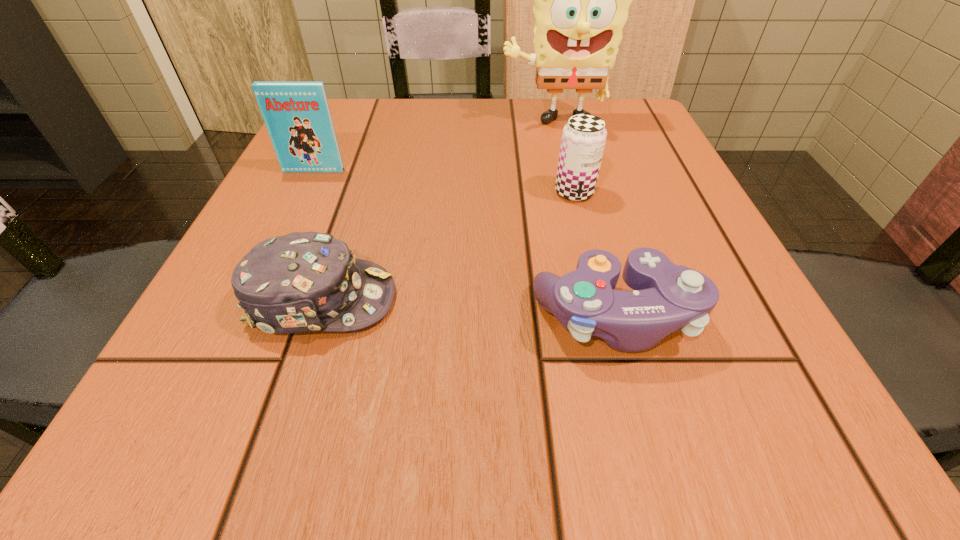
At what (x,y) coordinates should I click in order to perform the action: click on the tallest object. Please return your answer as a coordinate pair (x, y). The width and height of the screenshot is (960, 540). Looking at the image, I should click on (582, 0).

At what (x,y) coordinates should I click in order to perform the action: click on the farthest object. Please return your answer as a coordinate pair (x, y). Image resolution: width=960 pixels, height=540 pixels. Looking at the image, I should click on (582, 0).

The width and height of the screenshot is (960, 540). Find the location of `book`. book is located at coordinates (297, 116).

The height and width of the screenshot is (540, 960). Identify the location of the fourth shortest object. (297, 116).

Locate an element on the screen. the third shortest object is located at coordinates click(x=583, y=140).

Find the location of `the third nearest object`. the third nearest object is located at coordinates (583, 140).

Find the location of a particular element. This screenshot has width=960, height=540. control is located at coordinates (667, 297).

I want to click on headwear, so click(300, 282).

Find the location of a particular element. The image size is (960, 540). free point located on the face of the sponge is located at coordinates (560, 149).

Locate an element on the screen. vacant space located 0.090m on the front cover of the fourth shortest object is located at coordinates click(x=299, y=202).